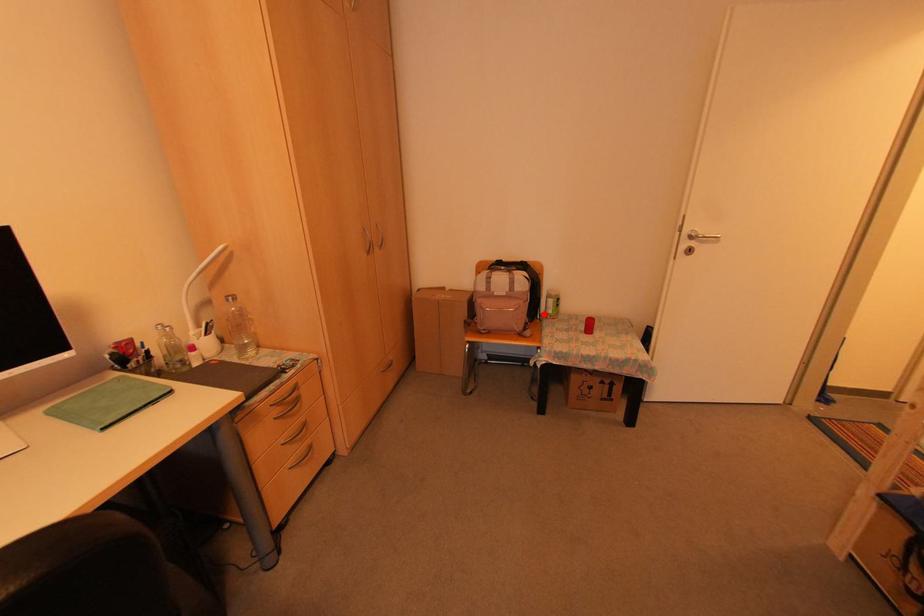
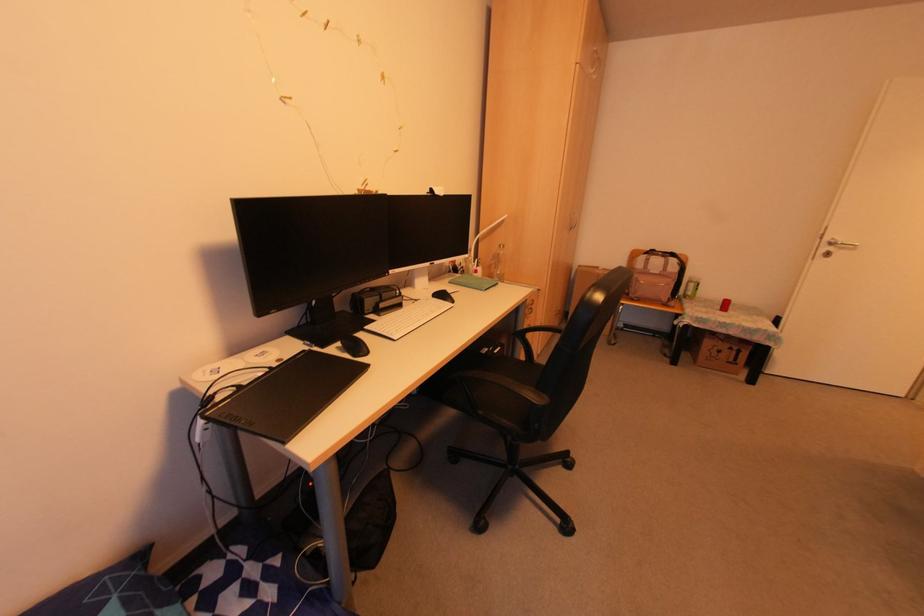
In the second image, find the point that corresponds to the highlighted location in the first image.

(683, 296)